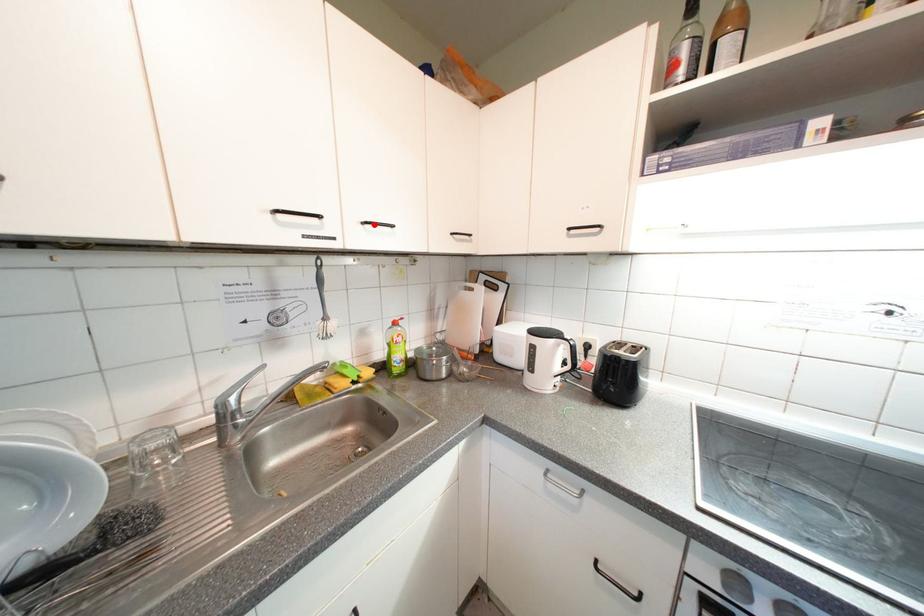
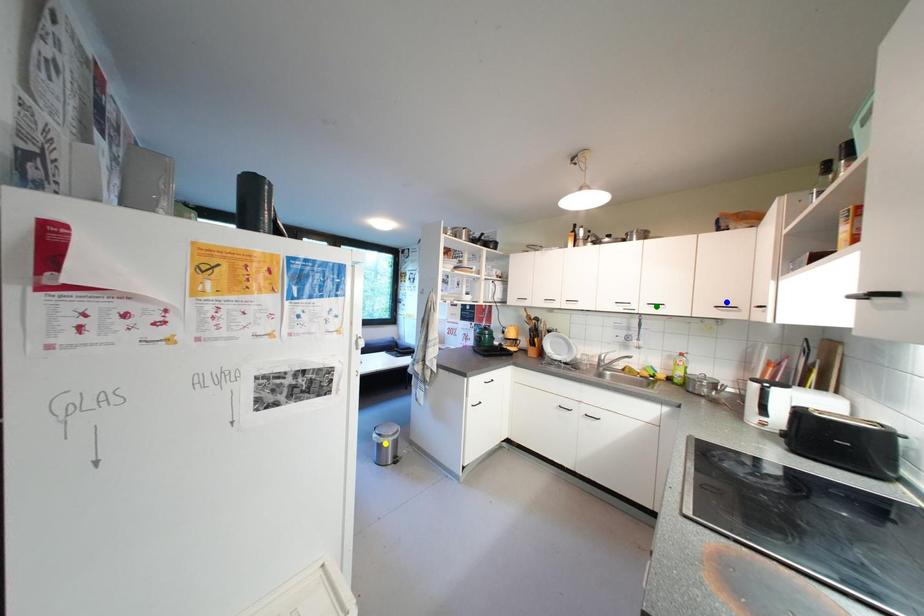
Question: I am providing you with two images of the same scene from different viewpoints. A red point is marked on the first image. You are given multiple points on the second image. Which point in image 2 is actually the same real-world point as the red point in image 1?

Choices:
 (A) green point
 (B) yellow point
 (C) blue point

Answer: (A)